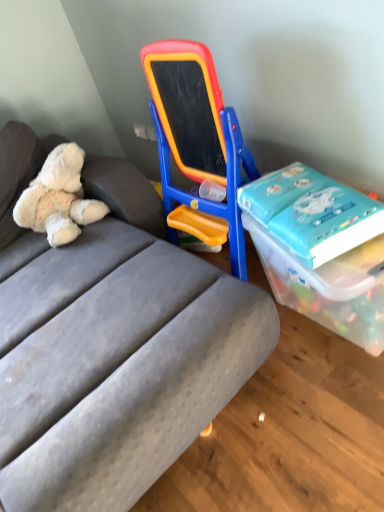
Identify the location of gray fabric studio couch at center. This screenshot has width=384, height=512. (115, 351).

Measure the distance between blue glossy book at right and camera.

A distance of 1.21 meters exists between blue glossy book at right and camera.

At what (x,y) coordinates should I click in order to perform the action: click on transparent plastic box at right. Please return your answer as a coordinate pair (x, y). The height and width of the screenshot is (512, 384). Looking at the image, I should click on (329, 286).

Can you confirm if transparent plastic box at right is taller than blue glossy book at right?

Indeed, transparent plastic box at right has a greater height compared to blue glossy book at right.

Between point (274, 254) and point (294, 239), which one is positioned behind?

The point (274, 254) is behind.

Is the depth of transparent plastic box at right greater than that of blue glossy book at right?

No, transparent plastic box at right is closer to the viewer.

From the picture: Which object is positioned more to the right, transparent plastic box at right or blue glossy book at right?

Positioned to the right is transparent plastic box at right.

You are a GUI agent. You are given a task and a screenshot of the screen. Output one action in this format:
    pyautogui.click(x=<x>, y=<y>)
    Task: Click on the teddy bear on the left of transparent plastic box at right
    The height and width of the screenshot is (512, 384).
    Given the screenshot: What is the action you would take?
    pyautogui.click(x=58, y=198)

From the image's perspective, which one is positioned higher, white plush teddy bear at left or transparent plastic box at right?

From the image's view, white plush teddy bear at left is above.

Considering the positions of objects white plush teddy bear at left and transparent plastic box at right in the image provided, who is more to the right, white plush teddy bear at left or transparent plastic box at right?

Positioned to the right is transparent plastic box at right.

Is white plush teddy bear at left not within transparent plastic box at right?

Yes, white plush teddy bear at left is located beyond the bounds of transparent plastic box at right.

From the image's perspective, which is above, gray fabric studio couch at center or blue glossy book at right?

From the image's view, blue glossy book at right is above.

Is gray fabric studio couch at center oriented towards blue glossy book at right?

No, gray fabric studio couch at center is not facing towards blue glossy book at right.

Is the surface of gray fabric studio couch at center in direct contact with blue glossy book at right?

gray fabric studio couch at center and blue glossy book at right are not in contact.

Based on their sizes in the image, would you say gray fabric studio couch at center is bigger or smaller than blue glossy book at right?

Considering their sizes, gray fabric studio couch at center takes up more space than blue glossy book at right.

In the scene shown: In terms of size, does transparent plastic box at right appear bigger or smaller than gray fabric studio couch at center?

transparent plastic box at right is smaller than gray fabric studio couch at center.

From the picture: Is transparent plastic box at right touching gray fabric studio couch at center?

transparent plastic box at right and gray fabric studio couch at center are not in contact.

How many degrees apart are the facing directions of transparent plastic box at right and gray fabric studio couch at center?

1.7 degrees separate the facing orientations of transparent plastic box at right and gray fabric studio couch at center.

From the image's perspective, is transparent plastic box at right above or below gray fabric studio couch at center?

Clearly, from the image's perspective, transparent plastic box at right is below gray fabric studio couch at center.

Considering the sizes of white plush teddy bear at left and blue glossy book at right in the image, is white plush teddy bear at left bigger or smaller than blue glossy book at right?

In the image, white plush teddy bear at left appears to be larger than blue glossy book at right.

Which point is more distant from viewer, (57, 195) or (339, 223)?

The point (57, 195) is farther.

Is white plush teddy bear at left taller than blue glossy book at right?

Indeed, white plush teddy bear at left has a greater height compared to blue glossy book at right.

Is white plush teddy bear at left not near blue glossy book at right?

Actually, white plush teddy bear at left and blue glossy book at right are a little close together.

Considering the sizes of objects white plush teddy bear at left and gray fabric studio couch at center in the image provided, who is smaller, white plush teddy bear at left or gray fabric studio couch at center?

Smaller between the two is white plush teddy bear at left.

Who is taller, white plush teddy bear at left or gray fabric studio couch at center?

gray fabric studio couch at center is taller.

Could you tell me if white plush teddy bear at left is turned towards gray fabric studio couch at center?

Yes.

Identify the location of studio couch below the white plush teddy bear at left (from a real-world perspective). (115, 351).

Is transparent plastic box at right not within white plush teddy bear at left?

That's correct, transparent plastic box at right is outside of white plush teddy bear at left.

In the image, is transparent plastic box at right positioned in front of or behind white plush teddy bear at left?

Visually, transparent plastic box at right is located in front of white plush teddy bear at left.

Is transparent plastic box at right facing towards white plush teddy bear at left?

No, transparent plastic box at right is not aimed at white plush teddy bear at left.

Locate an element on the screen. book behind the transparent plastic box at right is located at coordinates (312, 212).

Where is `teddy bear that is above the transparent plastic box at right (from the image's perspective)`? This screenshot has height=512, width=384. teddy bear that is above the transparent plastic box at right (from the image's perspective) is located at coordinates (58, 198).

Looking at the image, which one is located closer to transparent plastic box at right, gray fabric studio couch at center or white plush teddy bear at left?

Among the two, gray fabric studio couch at center is located nearer to transparent plastic box at right.

Based on their spatial positions, is transparent plastic box at right or blue glossy book at right closer to gray fabric studio couch at center?

Among the two, transparent plastic box at right is located nearer to gray fabric studio couch at center.

Considering their positions, is blue glossy book at right positioned closer to transparent plastic box at right than white plush teddy bear at left?

blue glossy book at right lies closer to transparent plastic box at right than the other object.

Based on their spatial positions, is white plush teddy bear at left or blue glossy book at right closer to gray fabric studio couch at center?

white plush teddy bear at left.

Considering their positions, is white plush teddy bear at left positioned closer to gray fabric studio couch at center than transparent plastic box at right?

white plush teddy bear at left is closer to gray fabric studio couch at center.

Looking at the image, which one is located further to blue glossy book at right, white plush teddy bear at left or gray fabric studio couch at center?

white plush teddy bear at left is further to blue glossy book at right.

Estimate the real-world distances between objects in this image. Which object is further from blue glossy book at right, gray fabric studio couch at center or transparent plastic box at right?

gray fabric studio couch at center lies further to blue glossy book at right than the other object.

When comparing their distances from transparent plastic box at right, does blue glossy book at right or gray fabric studio couch at center seem further?

The object further to transparent plastic box at right is gray fabric studio couch at center.

I want to click on book situated between white plush teddy bear at left and transparent plastic box at right from left to right, so click(x=312, y=212).

Locate an element on the screen. The image size is (384, 512). studio couch between white plush teddy bear at left and blue glossy book at right is located at coordinates (115, 351).

Find the location of a particular element. This screenshot has width=384, height=512. book located between gray fabric studio couch at center and transparent plastic box at right in the left-right direction is located at coordinates (312, 212).

The height and width of the screenshot is (512, 384). I want to click on studio couch situated between white plush teddy bear at left and transparent plastic box at right from left to right, so click(x=115, y=351).